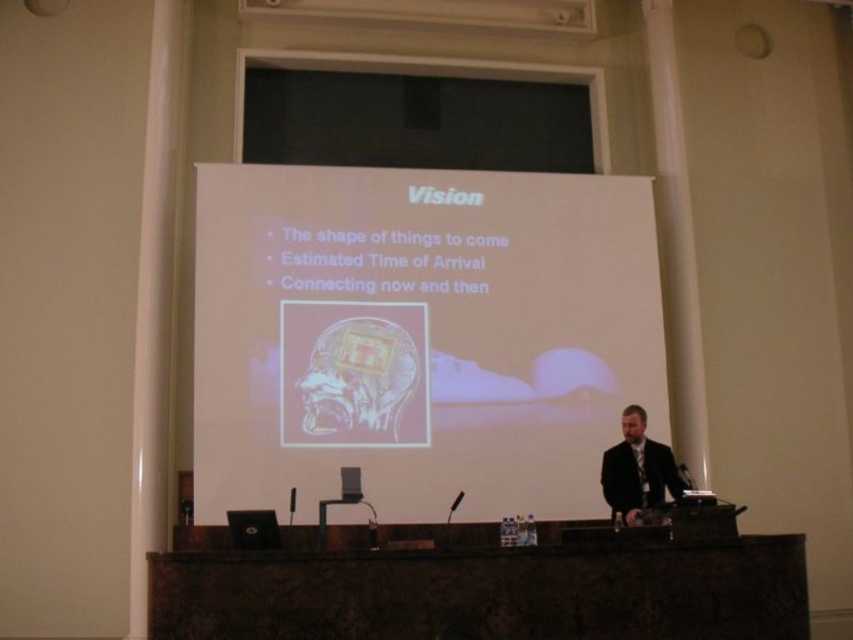
In the scene shown: You are sitting in the audience and looking at the presentation screen. There are two points marked on the screen. One is at coordinate point (x=364, y=138) and the other is at coordinate point (x=619, y=488). Which point appears closer to you?

Point (x=364, y=138) is further to the camera than point (x=619, y=488), so the point at (x=619, y=488) appears closer to you.

You are a guest speaker at the conference and need to place a large binder on the table. Can you fit it on the brown marble table at center without it hanging over the edge? The binder is as wide as the black matte screen at upper center.

The brown marble table at center might be wider than black matte screen at upper center, so there is a possibility the binder will fit. However, since the exact width difference is not specified, it is uncertain. You should check the table dimensions before placing the binder.

You are an attendee sitting in the front row of the presentation. You notice two points marked on the projection screen. The first point is at coordinate point(599, 358) and the second is at point(630, 440). Which point is closer to you?

Point(599, 358) is behind point(630, 440), so the point closer to you is point(630, 440).